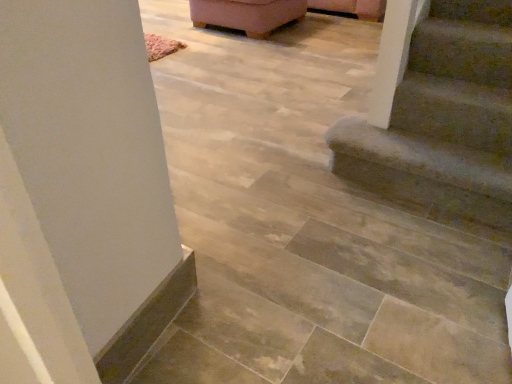
Question: Would you say pink fabric ottoman at upper center is inside or outside textured carpet stairs at lower right?

Choices:
 (A) inside
 (B) outside

Answer: (B)

Question: Looking at their shapes, would you say pink fabric ottoman at upper center is wider or thinner than textured carpet stairs at lower right?

Choices:
 (A) wide
 (B) thin

Answer: (A)

Question: Visually, is pink fabric ottoman at upper center positioned to the left or to the right of textured carpet stairs at lower right?

Choices:
 (A) right
 (B) left

Answer: (B)

Question: Is textured carpet stairs at lower right taller or shorter than pink fabric ottoman at upper center?

Choices:
 (A) short
 (B) tall

Answer: (A)

Question: In the image, is textured carpet stairs at lower right on the left side or the right side of pink fabric ottoman at upper center?

Choices:
 (A) right
 (B) left

Answer: (A)

Question: From a real-world perspective, is textured carpet stairs at lower right above or below pink fabric ottoman at upper center?

Choices:
 (A) above
 (B) below

Answer: (B)

Question: Would you say textured carpet stairs at lower right is inside or outside pink fabric ottoman at upper center?

Choices:
 (A) outside
 (B) inside

Answer: (A)